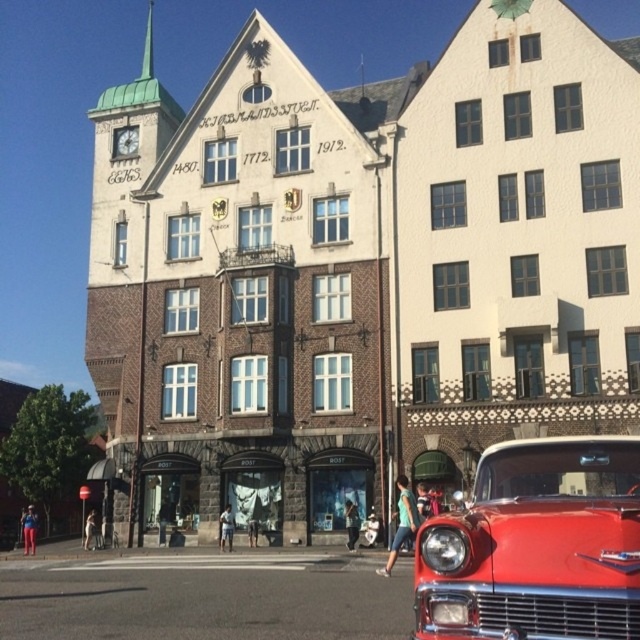
You are a tourist standing in front of the historic building. You notice two parts of the building facade labeled as brick building at center and white painted wood building at center. Which one is positioned more to the left side of the building?

Result: The brick building at center is positioned more to the left side of the building than the white painted wood building at center.

You are standing in the middle of the street looking at the brick building at center and the shiny red car at lower right. Which object is closer to the left side of your view?

The brick building at center is positioned on the left side of shiny red car at lower right, so it is closer to the left side of your view.

You are a photographer standing in front of the white painted wood building at center and the shiny red car at lower right. You want to capture a photo where both objects are visible. Given their heights, which object will appear taller in the photo?

The white painted wood building at center appears taller in the photo because it has a greater height compared to the shiny red car at lower right.